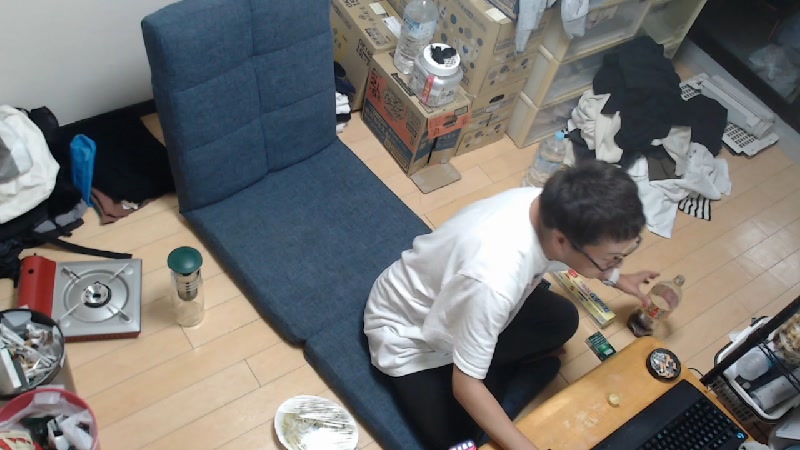
Identify the location of ash tray. (670, 367).